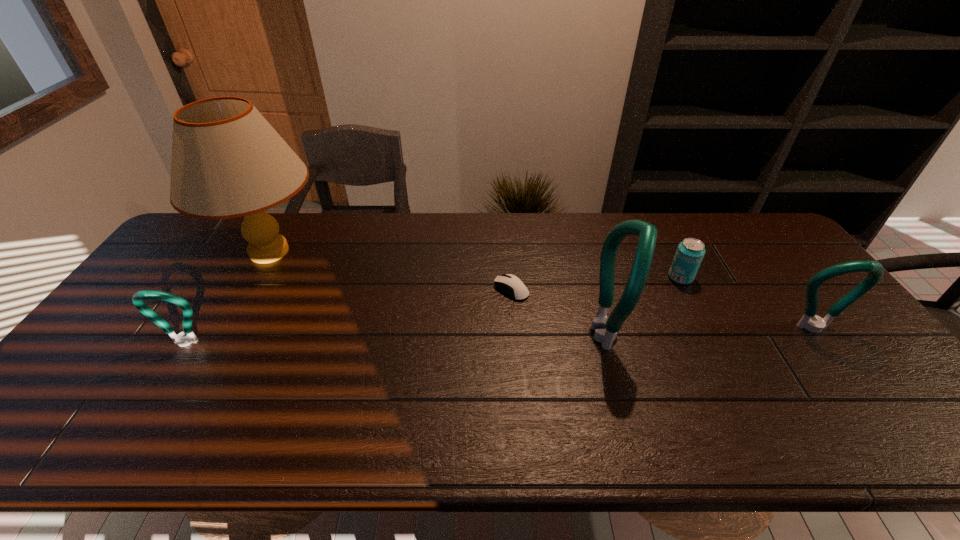
The height and width of the screenshot is (540, 960). Find the location of `vacant position for inserting another bottle_opener evenly`. vacant position for inserting another bottle_opener evenly is located at coordinates (398, 339).